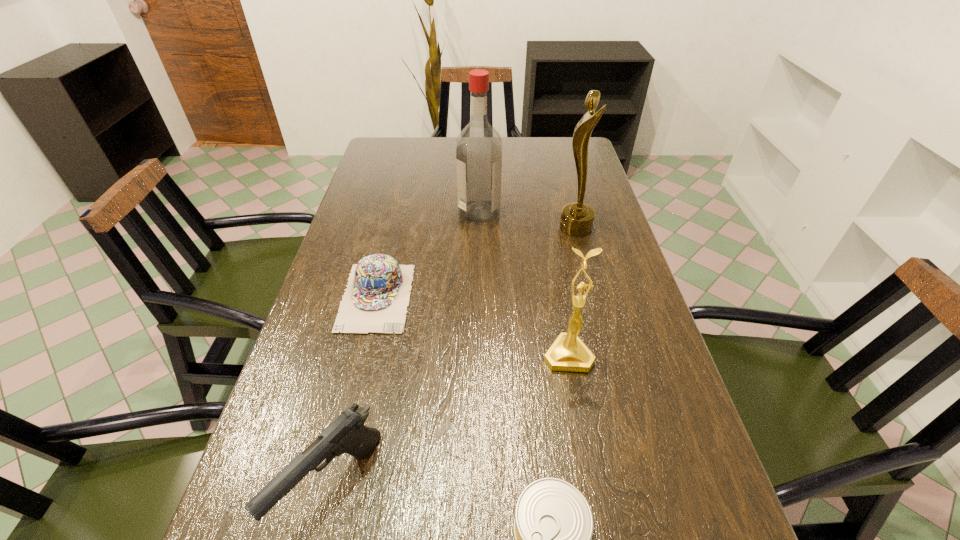
I want to click on liquor, so click(479, 147).

Where is `the taller award`? The height and width of the screenshot is (540, 960). the taller award is located at coordinates (577, 218).

You are a GUI agent. You are given a task and a screenshot of the screen. Output one action in this format:
    pyautogui.click(x=<x>, y=<y>)
    Task: Click on the shorter award
    Image resolution: width=960 pixels, height=540 pixels.
    Given the screenshot: What is the action you would take?
    pyautogui.click(x=568, y=353)

Where is `the fourth shortest object`? This screenshot has height=540, width=960. the fourth shortest object is located at coordinates (568, 353).

You are a GUI agent. You are given a task and a screenshot of the screen. Output one action in this format:
    pyautogui.click(x=<x>, y=<y>)
    Task: Click on the second shortest object
    
    Given the screenshot: What is the action you would take?
    pyautogui.click(x=377, y=295)

This screenshot has width=960, height=540. Identify the location of cap. pyautogui.click(x=377, y=295).

Locate an element on the screen. The width and height of the screenshot is (960, 540). blank space located on the front-facing side of the liquor is located at coordinates (536, 211).

What are the coordinates of `blank area located 0.310m on the front-facing side of the farther award` in the screenshot? It's located at (453, 228).

Find the location of a particular element. The image size is (960, 540). free space located 0.210m on the front-facing side of the farther award is located at coordinates (488, 228).

Where is `vacant area located on the front-facing side of the farther award`? This screenshot has height=540, width=960. vacant area located on the front-facing side of the farther award is located at coordinates (516, 228).